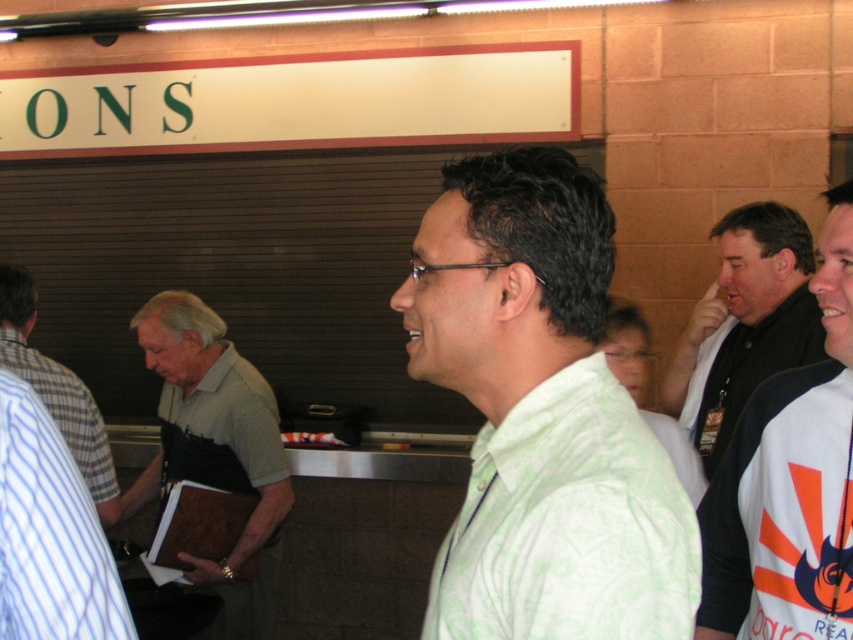
Between white jersey at right and gray fabric shirt at left, which one has less height?

Standing shorter between the two is white jersey at right.

Which is behind, point (786, 593) or point (256, 576)?

Point (256, 576)

Identify the location of white jersey at right. The width and height of the screenshot is (853, 640). (788, 483).

Is striped cotton shirt at left to the left of light green patterned shirt at center from the viewer's perspective?

Yes, striped cotton shirt at left is to the left of light green patterned shirt at center.

Is striped cotton shirt at left above light green patterned shirt at center?

Yes.

Is point (84, 467) in front of point (651, 355)?

No, (84, 467) is behind (651, 355).

Where is `striped cotton shirt at left`? The width and height of the screenshot is (853, 640). striped cotton shirt at left is located at coordinates (56, 390).

The height and width of the screenshot is (640, 853). Describe the element at coordinates (215, 449) in the screenshot. I see `gray fabric shirt at left` at that location.

Does gray fabric shirt at left appear under light green patterned shirt at center?

Yes.

Describe the element at coordinates (215, 449) in the screenshot. I see `gray fabric shirt at left` at that location.

Find the location of a particular element. gray fabric shirt at left is located at coordinates (215, 449).